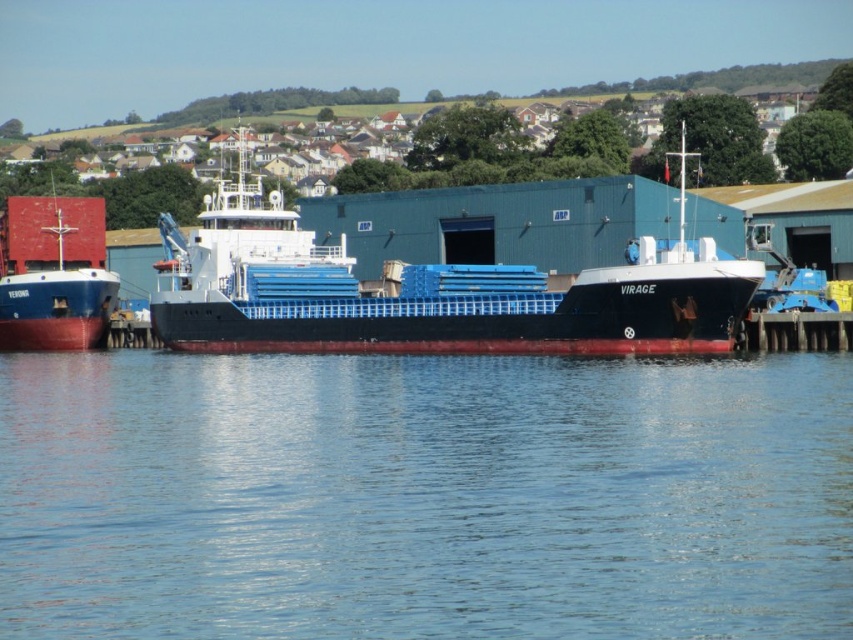
Is transparent blue water at center above blue matte cargo ship at center?

No, transparent blue water at center is not above blue matte cargo ship at center.

Does point (521, 456) lie in front of point (207, 220)?

Yes, it is in front of point (207, 220).

Consider the image. Who is more distant from viewer, (277, 362) or (352, 324)?

Positioned behind is point (352, 324).

This screenshot has width=853, height=640. What are the coordinates of `transparent blue water at center` in the screenshot? It's located at (424, 497).

Is point (35, 538) closer to viewer compared to point (97, 336)?

Yes, point (35, 538) is in front of point (97, 336).

The width and height of the screenshot is (853, 640). Describe the element at coordinates (424, 497) in the screenshot. I see `transparent blue water at center` at that location.

Locate an element on the screen. transparent blue water at center is located at coordinates (424, 497).

From the picture: Between blue matte cargo ship at center and matte red ship at left, which one has less height?

matte red ship at left

Does blue matte cargo ship at center have a larger size compared to matte red ship at left?

Yes, blue matte cargo ship at center is bigger than matte red ship at left.

Is point (596, 282) closer to camera compared to point (114, 276)?

Yes, point (596, 282) is in front of point (114, 276).

Where is `blue matte cargo ship at center`? The image size is (853, 640). blue matte cargo ship at center is located at coordinates (430, 292).